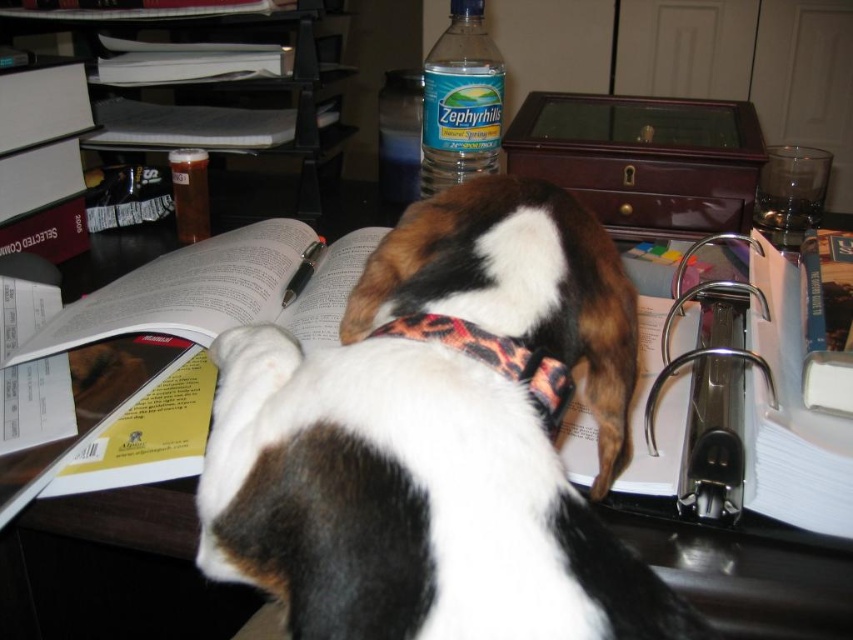
Question: Which of the following is the farthest from the observer?

Choices:
 (A) (347, 129)
 (B) (467, 490)

Answer: (A)

Question: Which of the following is the farthest from the observer?

Choices:
 (A) brown and white fur at center
 (B) leopard print fabric neckband at center
 (C) black plastic file at upper left

Answer: (C)

Question: Is brown and white fur at center smaller than leopard print fabric neckband at center?

Choices:
 (A) no
 (B) yes

Answer: (A)

Question: Is brown and white fur at center smaller than black plastic file at upper left?

Choices:
 (A) no
 (B) yes

Answer: (B)

Question: Which point is farther to the camera?

Choices:
 (A) leopard print fabric neckband at center
 (B) black plastic file at upper left
 (C) clear plastic bottle at upper center

Answer: (C)

Question: Is brown and white fur at center bigger than clear plastic bottle at upper center?

Choices:
 (A) yes
 (B) no

Answer: (A)